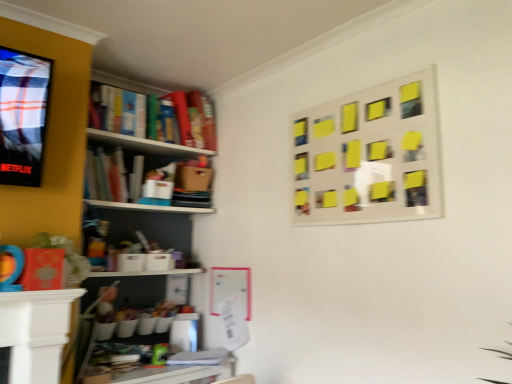
Question: Is wooden desk at lower center, placed as the 2th table when sorted from top to bottom, wider or thinner than white glossy table at lower left, acting as the 1th table starting from the front?

Choices:
 (A) wide
 (B) thin

Answer: (A)

Question: Relative to white glossy table at lower left, which ranks as the first table in top-to-bottom order, is wooden desk at lower center, positioned as the 2th table in front-to-back order, in front or behind?

Choices:
 (A) behind
 (B) front

Answer: (A)

Question: Which object is the farthest from the wooden desk at lower center, positioned as the 2th table in front-to-back order?

Choices:
 (A) white glossy table at lower left, acting as the 1th table starting from the front
 (B) yellow sticky notes at upper right

Answer: (B)

Question: Considering the real-world distances, which object is farthest from the wooden desk at lower center, the 1th table viewed from the back?

Choices:
 (A) yellow sticky notes at upper right
 (B) white glossy table at lower left, which ranks as the first table in top-to-bottom order

Answer: (A)